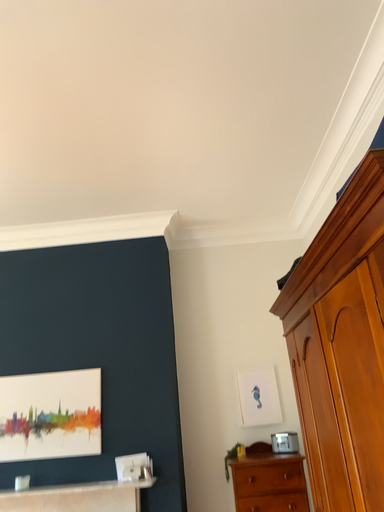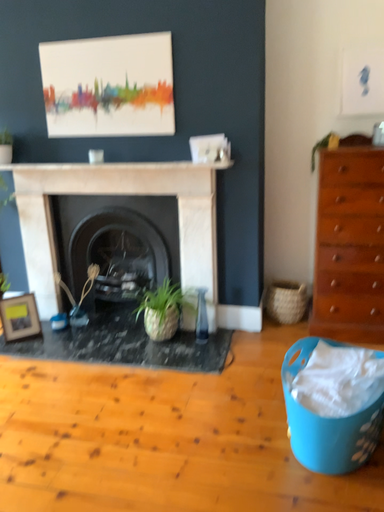
Question: Which way did the camera rotate in the video?

Choices:
 (A) rotated downward
 (B) rotated upward

Answer: (A)